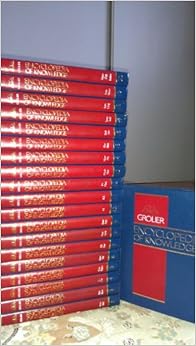
Identify the location of patterns on counter top. Image resolution: width=196 pixels, height=346 pixels. (62, 330), (93, 332), (122, 314), (172, 332), (24, 327), (174, 342), (137, 309).